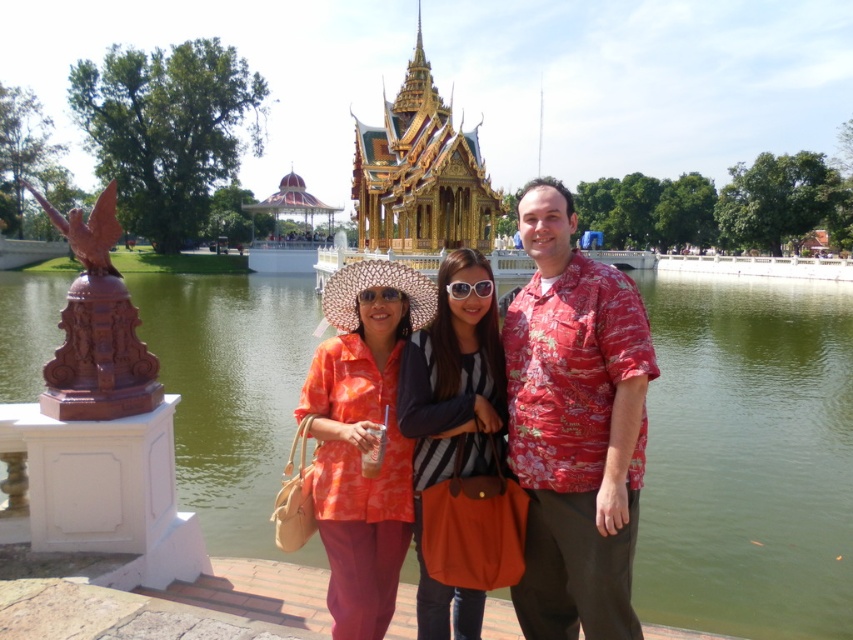
Question: Among these objects, which one is farthest from the camera?

Choices:
 (A) matte orange shirt at center
 (B) striped fabric shirt at center

Answer: (B)

Question: In this image, where is floral print shirt at center located relative to matte black goggles at center?

Choices:
 (A) below
 (B) above

Answer: (A)

Question: Which point is farther from the camera taking this photo?

Choices:
 (A) [608, 538]
 (B) [456, 291]
 (C) [471, 618]

Answer: (B)

Question: Which point is farther to the camera?

Choices:
 (A) floral print shirt at center
 (B) green water at center
 (C) matte orange shirt at center

Answer: (B)

Question: Can you confirm if floral print shirt at center is bigger than orange printed shirt at center?

Choices:
 (A) yes
 (B) no

Answer: (A)

Question: Is matte orange shirt at center positioned in front of white plastic goggles at center?

Choices:
 (A) yes
 (B) no

Answer: (A)